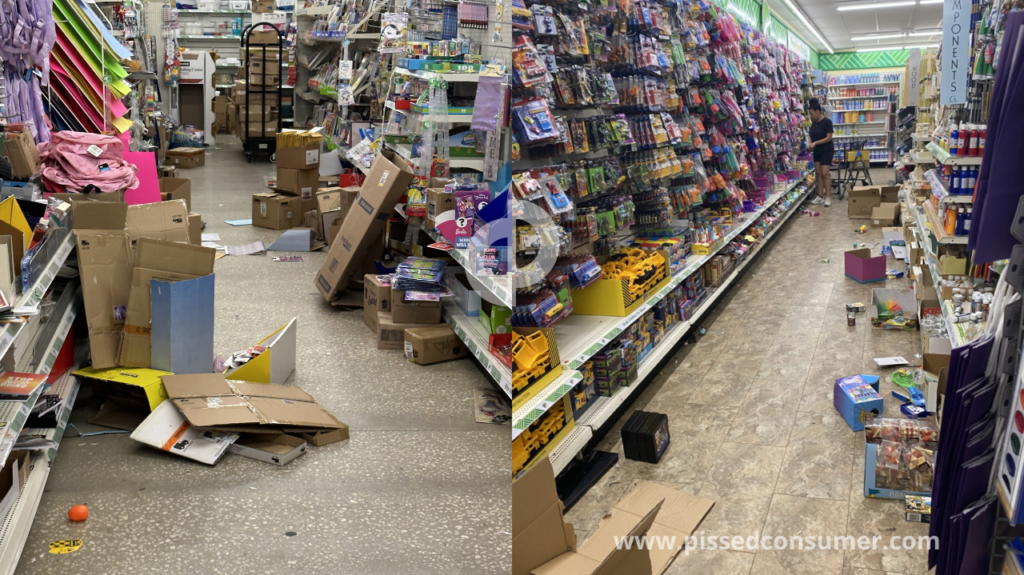
Image resolution: width=1024 pixels, height=575 pixels. I want to click on messy floor, so click(x=353, y=518), click(x=256, y=296), click(x=216, y=172).